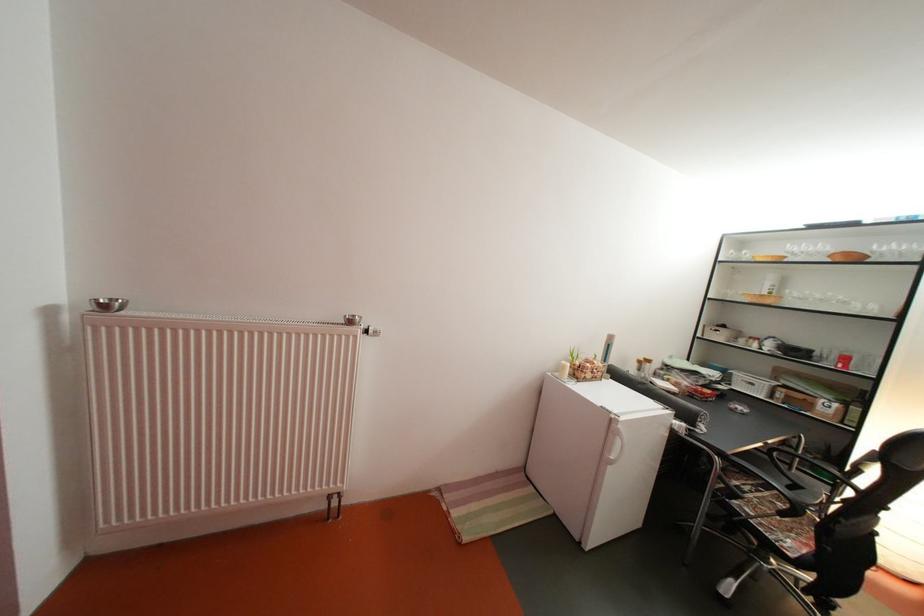
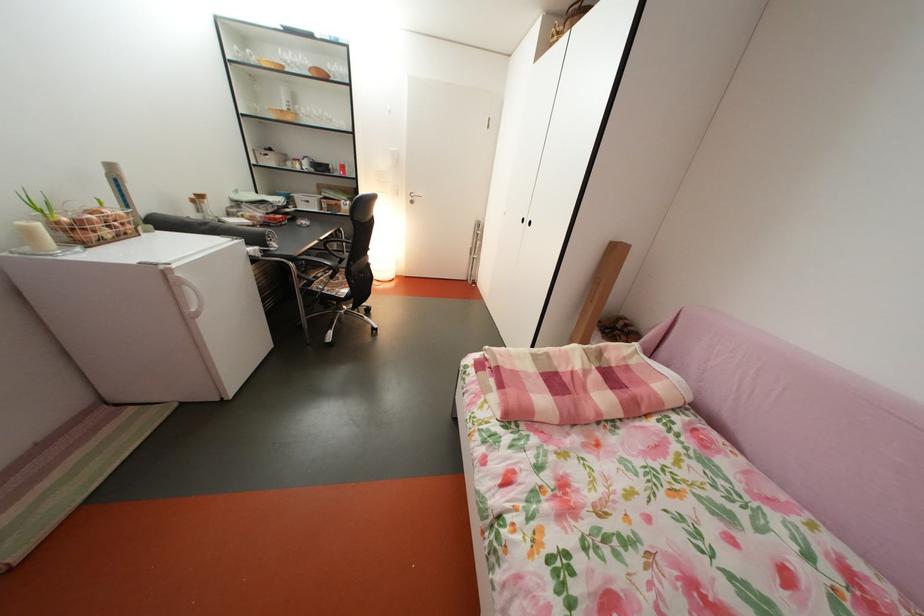
Find the pixel in the second image that matches point (733, 460) in the first image.

(304, 265)